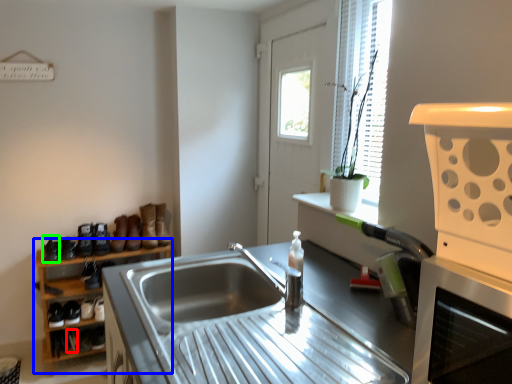
Question: Considering the real-world distances, which object is closest to shoe (highlighted by a red box)? shelf (highlighted by a blue box) or shoe (highlighted by a green box).

Choices:
 (A) shelf
 (B) shoe

Answer: (A)